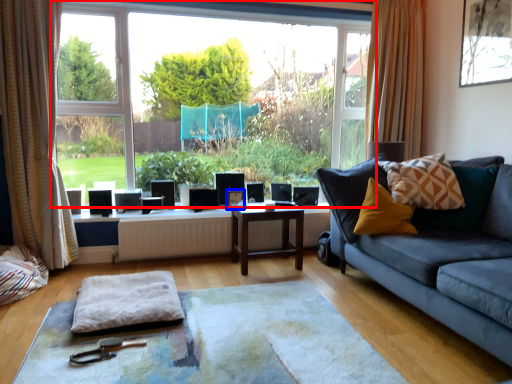
Question: Which of the following is the closest to the observer, window (highlighted by a red box) or picture frame (highlighted by a blue box)?

Choices:
 (A) window
 (B) picture frame

Answer: (A)